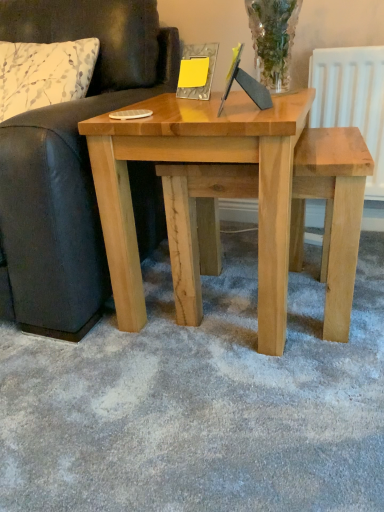
Question: Looking at their shapes, would you say natural wood table at center is wider or thinner than leather couch at left?

Choices:
 (A) thin
 (B) wide

Answer: (A)

Question: From the image's perspective, relative to leather couch at left, is natural wood table at center above or below?

Choices:
 (A) below
 (B) above

Answer: (A)

Question: Which object is the farthest from the natural wood stool at center?

Choices:
 (A) leather couch at left
 (B) white floral fabric pillow at left
 (C) natural wood table at center

Answer: (B)

Question: Which object is positioned closest to the natural wood table at center?

Choices:
 (A) natural wood stool at center
 (B) white floral fabric pillow at left
 (C) leather couch at left

Answer: (A)